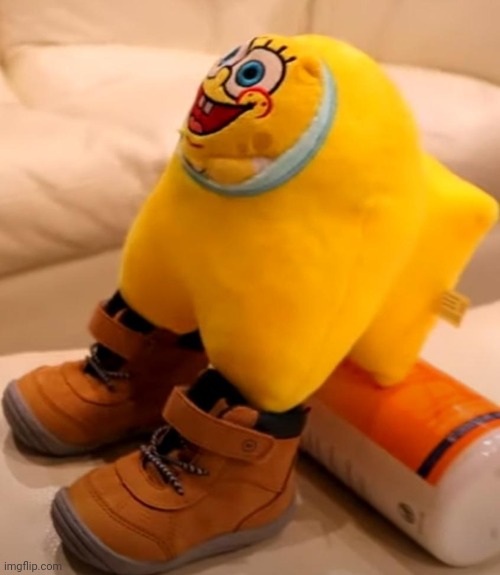
Where is `sponge`? sponge is located at coordinates (257, 95).